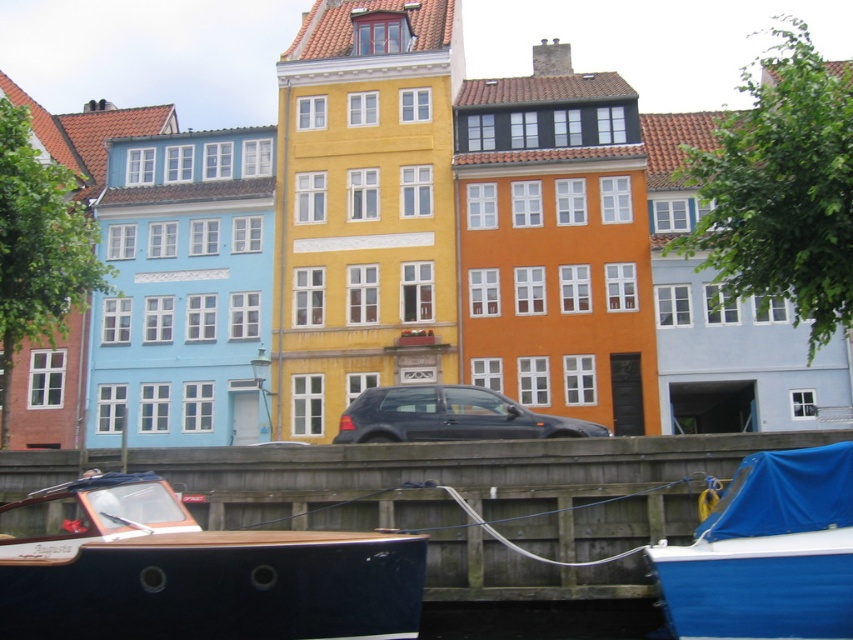
Can you confirm if dark blue polished wood boat at lower left is wider than blue fabric boat at lower right?

Yes.

Can you confirm if dark blue polished wood boat at lower left is bigger than blue fabric boat at lower right?

Indeed, dark blue polished wood boat at lower left has a larger size compared to blue fabric boat at lower right.

Is point (338, 573) less distant than point (770, 632)?

No, (338, 573) is behind (770, 632).

At what (x,y) coordinates should I click in order to perform the action: click on dark blue polished wood boat at lower left. Please return your answer as a coordinate pair (x, y). Image resolution: width=853 pixels, height=640 pixels. Looking at the image, I should click on (192, 572).

Does point (769, 579) lie in front of point (378, 419)?

Yes, it is in front of point (378, 419).

Image resolution: width=853 pixels, height=640 pixels. What are the coordinates of `blue fabric boat at lower right` in the screenshot? It's located at (767, 552).

Where is `blue fabric boat at lower right`? blue fabric boat at lower right is located at coordinates (767, 552).

From the picture: Is dark blue polished wood boat at lower left further to the viewer compared to satin black car at center?

No, it is not.

Which is behind, point (308, 609) or point (343, 416)?

Positioned behind is point (343, 416).

What do you see at coordinates (192, 572) in the screenshot?
I see `dark blue polished wood boat at lower left` at bounding box center [192, 572].

You are a GUI agent. You are given a task and a screenshot of the screen. Output one action in this format:
    pyautogui.click(x=<x>, y=<y>)
    Task: Click on the dark blue polished wood boat at lower left
    
    Given the screenshot: What is the action you would take?
    pyautogui.click(x=192, y=572)